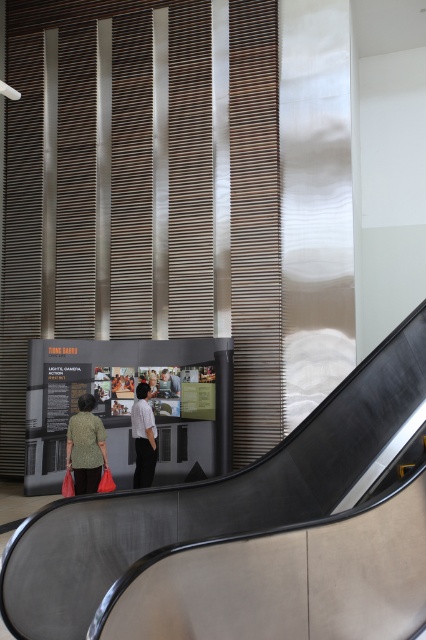
Does metallic gray escalator at lower center appear on the left side of green textured sweater at center?

Incorrect, metallic gray escalator at lower center is not on the left side of green textured sweater at center.

Can you confirm if metallic gray escalator at lower center is shorter than green textured sweater at center?

In fact, metallic gray escalator at lower center may be taller than green textured sweater at center.

Which is in front, point (342, 465) or point (78, 474)?

Point (342, 465) is more forward.

I want to click on metallic gray escalator at lower center, so click(x=210, y=497).

You are a GUI agent. You are given a task and a screenshot of the screen. Output one action in this format:
    pyautogui.click(x=<x>, y=<y>)
    Task: Click on the green textured sweater at center
    
    Given the screenshot: What is the action you would take?
    pyautogui.click(x=86, y=445)

Which is more to the left, green textured sweater at center or white textured shirt at center?

Positioned to the left is green textured sweater at center.

Is point (94, 484) closer to viewer compared to point (144, 448)?

Yes, it is.

Where is `green textured sweater at center`? green textured sweater at center is located at coordinates (86, 445).

Between point (250, 472) and point (149, 388), which one is positioned in front?

Point (250, 472)

Which is more to the right, metallic gray escalator at lower center or white textured shirt at center?

metallic gray escalator at lower center is more to the right.

Identify the location of metallic gray escalator at lower center. Image resolution: width=426 pixels, height=640 pixels. (210, 497).